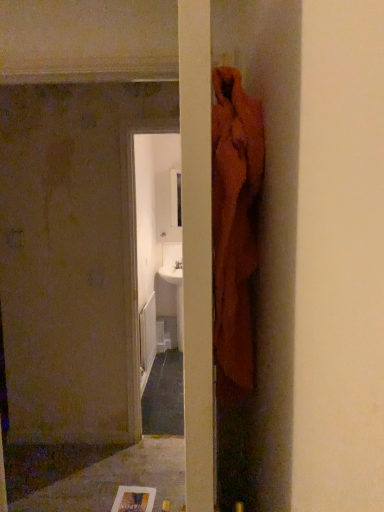
Where is `free point above smooth gray concrete at lower left (from a real-world perspective)`? free point above smooth gray concrete at lower left (from a real-world perspective) is located at coordinates coord(79,476).